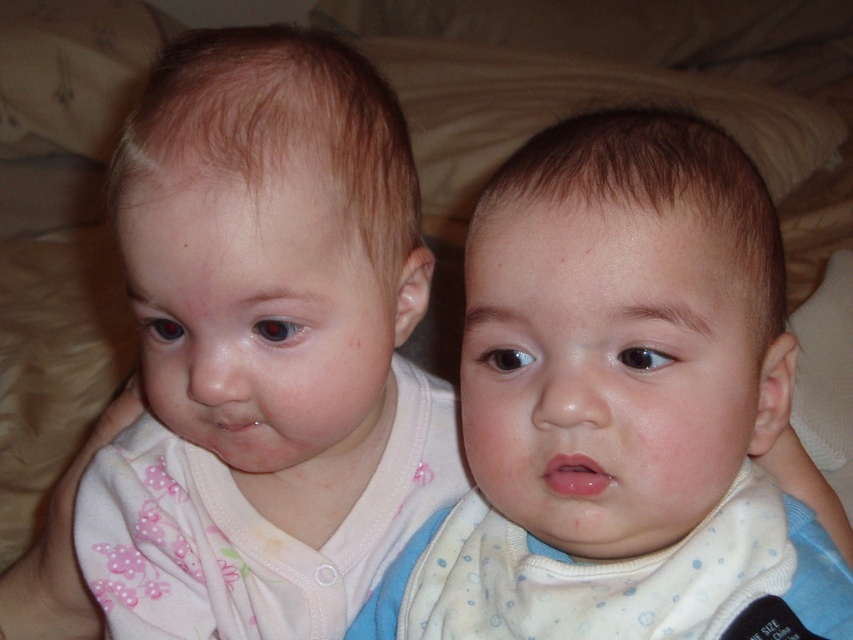
Question: Does white soft bib at center appear over pink fabric bib at center?

Choices:
 (A) yes
 (B) no

Answer: (A)

Question: Estimate the real-world distances between objects in this image. Which object is closer to the white soft bib at center?

Choices:
 (A) pink fabric bib at center
 (B) smooth skin baby at center

Answer: (B)

Question: Which object appears closest to the camera in this image?

Choices:
 (A) smooth skin baby at center
 (B) white soft bib at center

Answer: (A)

Question: Which object is farther from the camera taking this photo?

Choices:
 (A) white soft bib at center
 (B) smooth skin baby at center

Answer: (A)

Question: Is pink fabric face at left smaller than pink fabric bib at center?

Choices:
 (A) yes
 (B) no

Answer: (B)

Question: From the image, what is the correct spatial relationship of white soft bib at center in relation to pink fabric bib at center?

Choices:
 (A) below
 (B) above

Answer: (B)